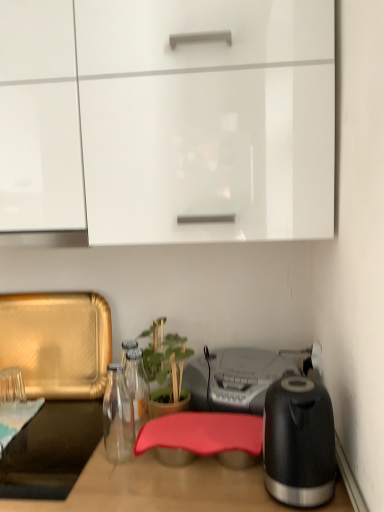
Question: In the image, is green matte plant at center on the left side or the right side of black glossy electric kettle at right?

Choices:
 (A) left
 (B) right

Answer: (A)

Question: From a real-world perspective, is green matte plant at center positioned above or below black glossy electric kettle at right?

Choices:
 (A) below
 (B) above

Answer: (A)

Question: Which is nearer to the black glossy electric kettle at right?

Choices:
 (A) green matte plant at center
 (B) metallic silver radio at center
 (C) white glossy cabinet at upper center

Answer: (B)

Question: Which object is the closest to the white glossy cabinet at upper center?

Choices:
 (A) metallic silver radio at center
 (B) black glossy electric kettle at right
 (C) green matte plant at center

Answer: (B)